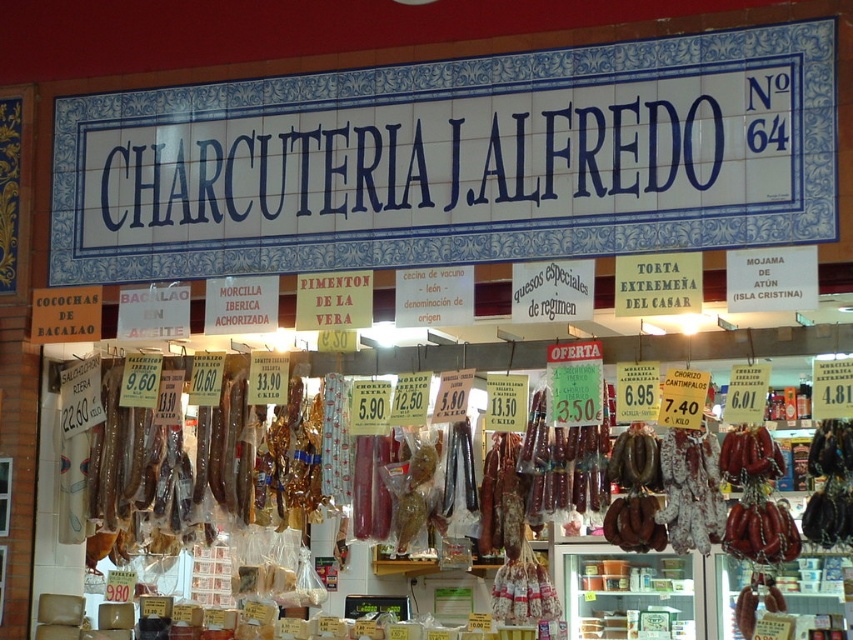
Can you confirm if brown leather sausages at center is bigger than brown leather belt at center?

Indeed, brown leather sausages at center has a larger size compared to brown leather belt at center.

Measure the distance between brown leather sausages at center and camera.

brown leather sausages at center and camera are 12.47 meters apart from each other.

Image resolution: width=853 pixels, height=640 pixels. Find the location of `brown leather sausages at center`. brown leather sausages at center is located at coordinates (199, 461).

Does brown leather sausages at center appear on the right side of shiny brown sausage at center?

No, brown leather sausages at center is not to the right of shiny brown sausage at center.

Measure the distance between brown leather sausages at center and shiny brown sausage at center.

The distance of brown leather sausages at center from shiny brown sausage at center is 4.43 meters.

This screenshot has height=640, width=853. Describe the element at coordinates (199, 461) in the screenshot. I see `brown leather sausages at center` at that location.

I want to click on brown leather sausages at center, so click(x=199, y=461).

Is shiny brown sausage at center thinner than brown leather belt at center?

In fact, shiny brown sausage at center might be wider than brown leather belt at center.

Locate an element on the screen. shiny brown sausage at center is located at coordinates (761, 532).